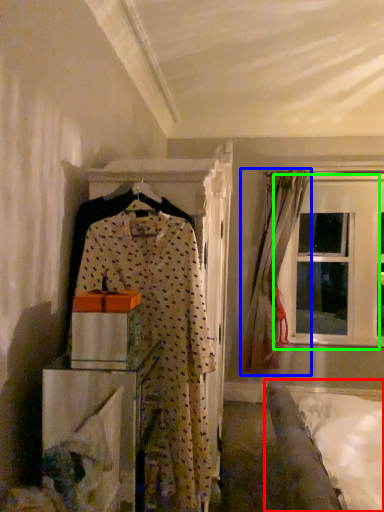
Question: Based on their relative distances, which object is farther from bed (highlighted by a red box)? Choose from curtain (highlighted by a blue box) and window (highlighted by a green box).

Choices:
 (A) curtain
 (B) window

Answer: (B)